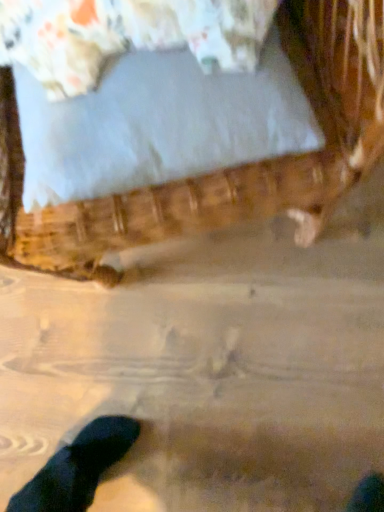
Question: Is white fabric pillow at upper center placed right next to wooden bed at upper center?

Choices:
 (A) no
 (B) yes

Answer: (A)

Question: Does white fabric pillow at upper center have a smaller size compared to wooden bed at upper center?

Choices:
 (A) yes
 (B) no

Answer: (A)

Question: Is white fabric pillow at upper center wider than wooden bed at upper center?

Choices:
 (A) yes
 (B) no

Answer: (B)

Question: Does white fabric pillow at upper center lie behind wooden bed at upper center?

Choices:
 (A) yes
 (B) no

Answer: (A)

Question: From the image's perspective, is white fabric pillow at upper center over wooden bed at upper center?

Choices:
 (A) no
 (B) yes

Answer: (A)

Question: From a real-world perspective, is white fabric pillow at upper center on wooden bed at upper center?

Choices:
 (A) no
 (B) yes

Answer: (B)

Question: Can you confirm if wooden bed at upper center is shorter than white fabric pillow at upper center?

Choices:
 (A) yes
 (B) no

Answer: (B)

Question: Is the surface of wooden bed at upper center in direct contact with white fabric pillow at upper center?

Choices:
 (A) no
 (B) yes

Answer: (A)

Question: Is wooden bed at upper center oriented towards white fabric pillow at upper center?

Choices:
 (A) no
 (B) yes

Answer: (B)

Question: Is wooden bed at upper center smaller than white fabric pillow at upper center?

Choices:
 (A) no
 (B) yes

Answer: (A)

Question: From the image's perspective, is wooden bed at upper center on top of white fabric pillow at upper center?

Choices:
 (A) yes
 (B) no

Answer: (A)

Question: Would you say wooden bed at upper center contains white fabric pillow at upper center?

Choices:
 (A) yes
 (B) no

Answer: (A)

Question: In the image, is white fabric pillow at upper center on the left side or the right side of wooden bed at upper center?

Choices:
 (A) left
 (B) right

Answer: (B)